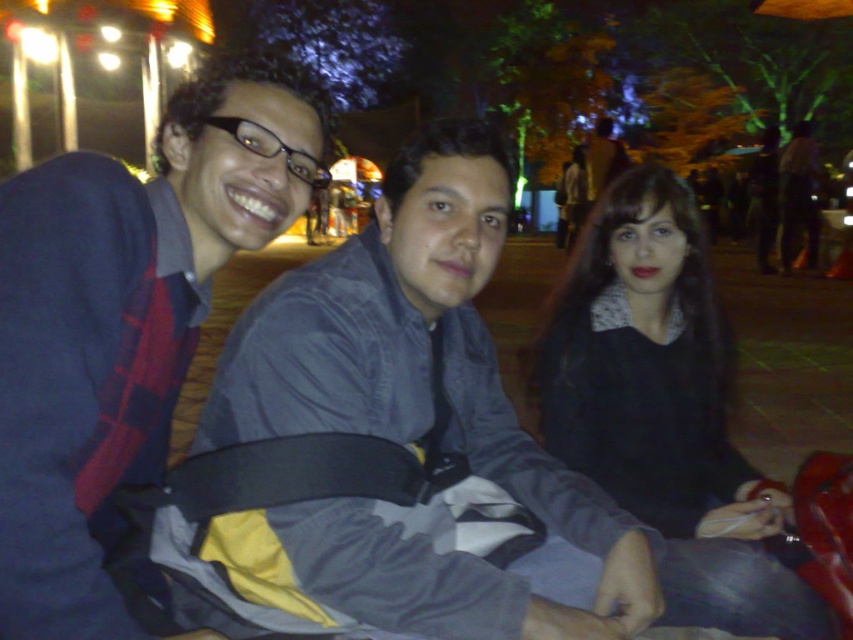
Is point (44, 168) farther from camera compared to point (552, 310)?

No, (44, 168) is in front of (552, 310).

Who is more forward, (100, 600) or (630, 216)?

Point (100, 600) is in front.

Is point (206, 116) positioned in front of point (598, 253)?

Yes, point (206, 116) is in front of point (598, 253).

Where is `plaid fabric shirt at left`? This screenshot has width=853, height=640. plaid fabric shirt at left is located at coordinates (126, 317).